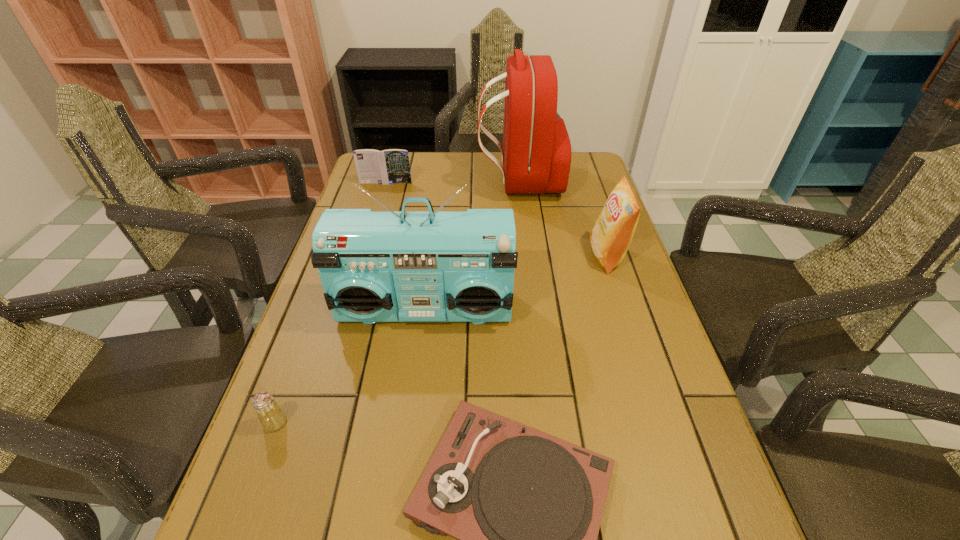
What are the coordinates of `vacant space located on the front-facing side of the radio receiver` in the screenshot? It's located at (409, 450).

Image resolution: width=960 pixels, height=540 pixels. Identify the location of free space located 0.220m on the front-facing side of the crisp (potato chip). [x=508, y=256].

Where is `vacant space located on the front-facing side of the crisp (potato chip)`? The height and width of the screenshot is (540, 960). vacant space located on the front-facing side of the crisp (potato chip) is located at coordinates (571, 256).

Locate an element on the screen. Image resolution: width=960 pixels, height=540 pixels. vacant space situated 0.090m on the front-facing side of the crisp (potato chip) is located at coordinates (557, 256).

Image resolution: width=960 pixels, height=540 pixels. I want to click on vacant space positioned on the front cover of the third shortest object, so click(366, 251).

Where is `vacant space located on the right of the saltshaker`? The width and height of the screenshot is (960, 540). vacant space located on the right of the saltshaker is located at coordinates (472, 422).

Identify the location of backpack positioned at the far edge. (536, 155).

The height and width of the screenshot is (540, 960). Identify the location of book that is at the far edge. tap(390, 166).

This screenshot has width=960, height=540. Find the location of `radio receiver located at the left edge`. radio receiver located at the left edge is located at coordinates (429, 266).

You are a GUI agent. You are given a task and a screenshot of the screen. Output one action in this format:
    pyautogui.click(x=<x>, y=<y>)
    Task: Click on the book located at the left edge
    
    Given the screenshot: What is the action you would take?
    pyautogui.click(x=390, y=166)